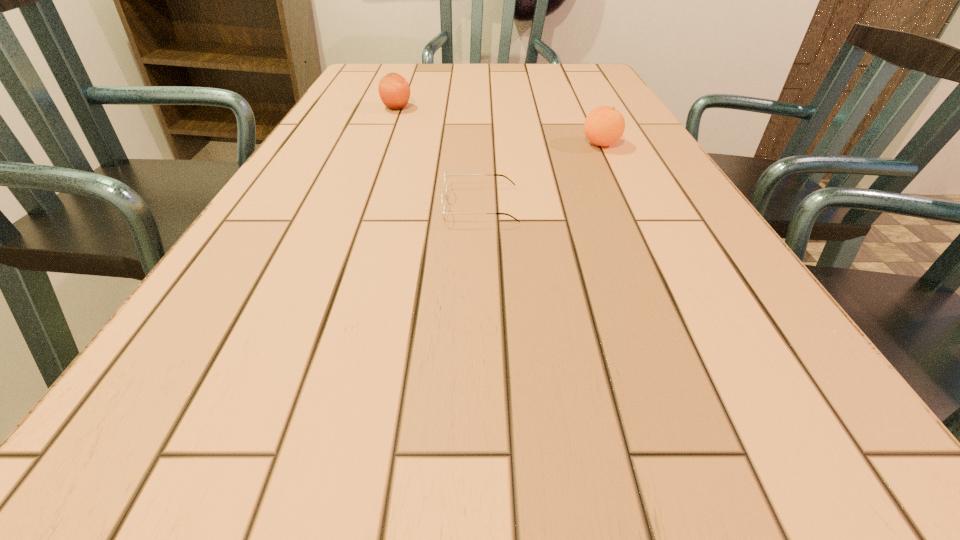
In order to click on vacant position located on the front-facing side of the nearest object in this screenshot , I will do `click(283, 205)`.

The image size is (960, 540). Identify the location of object positioned at the left edge. (394, 90).

Where is `object at the right edge`? The width and height of the screenshot is (960, 540). object at the right edge is located at coordinates [604, 125].

Where is `vacant space at the far edge of the desktop`? This screenshot has width=960, height=540. vacant space at the far edge of the desktop is located at coordinates (511, 83).

Where is `vacant space at the left edge of the desktop`? This screenshot has height=540, width=960. vacant space at the left edge of the desktop is located at coordinates click(311, 225).

You are a GUI agent. You are given a task and a screenshot of the screen. Output one action in this format:
    pyautogui.click(x=<x>, y=<y>)
    Task: Click on the free spot at the right edge of the desktop
    
    Given the screenshot: What is the action you would take?
    pyautogui.click(x=708, y=302)

In the image, there is a desktop. What are the coordinates of `vacant space at the near left corner` in the screenshot? It's located at (58, 502).

Image resolution: width=960 pixels, height=540 pixels. I want to click on free point at the far right corner, so pyautogui.click(x=588, y=88).

Find the location of a particular element. The width and height of the screenshot is (960, 540). free space between the second nearest object and the farthest object is located at coordinates (499, 126).

Where is `free space between the nearer orange and the spectacles`? Image resolution: width=960 pixels, height=540 pixels. free space between the nearer orange and the spectacles is located at coordinates (540, 175).